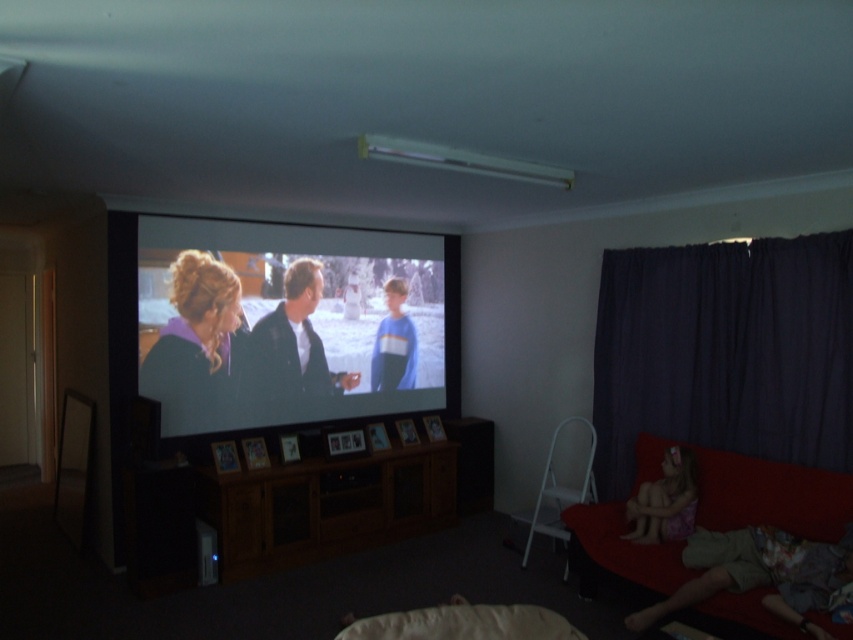
Based on the photo, how far apart are dark purple fabric at right and purple floral dress at lower right?

dark purple fabric at right is 64.05 centimeters from purple floral dress at lower right.

Based on the photo, between dark purple fabric at right and purple floral dress at lower right, which one has more height?

dark purple fabric at right is taller.

Is point (805, 432) farther from camera compared to point (660, 461)?

No, (805, 432) is in front of (660, 461).

At what (x,y) coordinates should I click in order to perform the action: click on dark purple fabric at right. Please return your answer as a coordinate pair (x, y). The image size is (853, 640). Looking at the image, I should click on (724, 352).

Which is more to the left, matte black hair at center or purple floral dress at lower right?

From the viewer's perspective, matte black hair at center appears more on the left side.

Is matte black hair at center taller than purple floral dress at lower right?

Yes, matte black hair at center is taller than purple floral dress at lower right.

Which is in front, point (170, 321) or point (668, 513)?

Point (668, 513) is in front.

Locate an element on the screen. The width and height of the screenshot is (853, 640). matte black hair at center is located at coordinates (193, 344).

Can you confirm if brown wood entertainment center at center is shorter than purple floral dress at lower right?

In fact, brown wood entertainment center at center may be taller than purple floral dress at lower right.

Can you confirm if brown wood entertainment center at center is positioned above purple floral dress at lower right?

Incorrect, brown wood entertainment center at center is not positioned above purple floral dress at lower right.

Where is `brown wood entertainment center at center`? brown wood entertainment center at center is located at coordinates (302, 506).